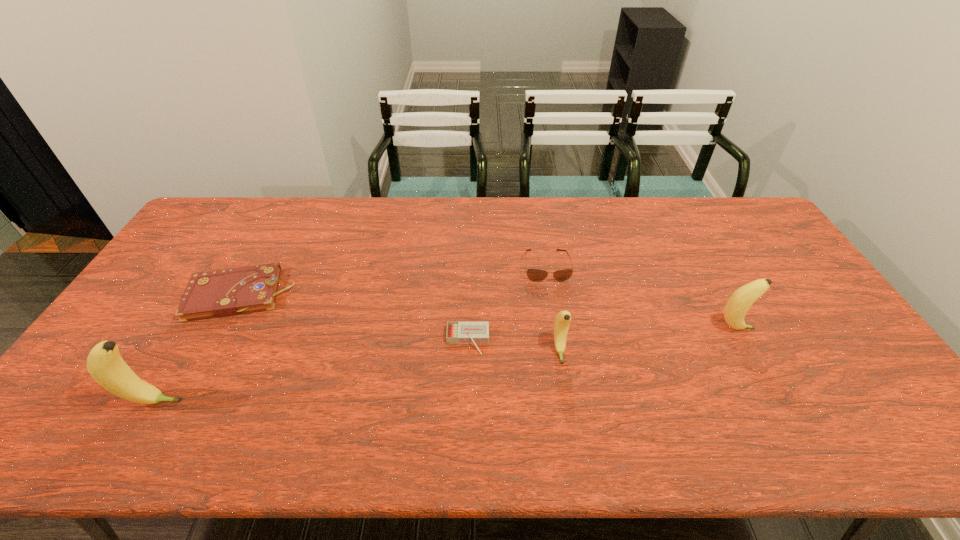
This screenshot has width=960, height=540. I want to click on blank space located 0.260m from the stem of the leftmost banana, so pyautogui.click(x=289, y=402).

Find the location of `vacant region located 0.060m from the stem of the second banana from left to right`. vacant region located 0.060m from the stem of the second banana from left to right is located at coordinates (564, 384).

This screenshot has height=540, width=960. Identify the location of vacant point located 0.210m from the stem of the rightmost object. (830, 329).

Locate an element on the screen. Image resolution: width=960 pixels, height=540 pixels. vacant region located on the front-facing side of the third shortest object is located at coordinates (558, 335).

At what (x,y) coordinates should I click in order to perform the action: click on free location located on the striking surface of the shortest object. Please return your answer as a coordinate pair (x, y). The width and height of the screenshot is (960, 540). Looking at the image, I should click on (467, 395).

The height and width of the screenshot is (540, 960). In order to click on free space located on the left of the fifth tallest object in this screenshot , I will do `click(151, 295)`.

What are the coordinates of `object present at the near edge` in the screenshot? It's located at (104, 363).

Find the location of a particular element. The height and width of the screenshot is (540, 960). banana present at the left edge is located at coordinates (104, 363).

Image resolution: width=960 pixels, height=540 pixels. I want to click on notebook that is positioned at the left edge, so click(x=221, y=293).

Find the location of a particular element. This screenshot has width=960, height=540. object present at the near left corner is located at coordinates (104, 363).